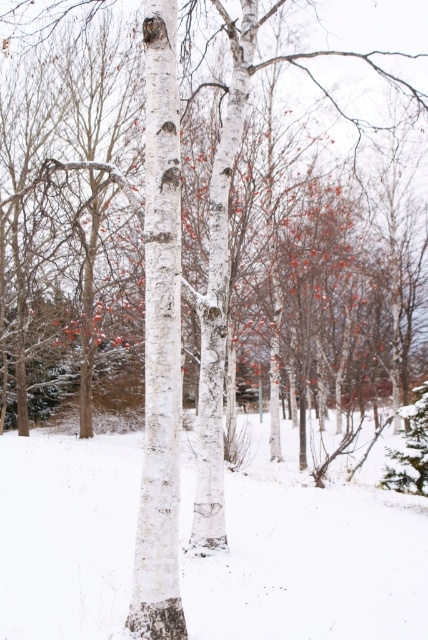
Locate an element on the screen. This screenshot has width=428, height=640. white matte snow at center is located at coordinates (309, 560).

Is point (35, 440) farther from viewer compared to point (145, 316)?

Yes, point (35, 440) is behind point (145, 316).

Where is `white matte snow at center`? The width and height of the screenshot is (428, 640). white matte snow at center is located at coordinates point(309,560).